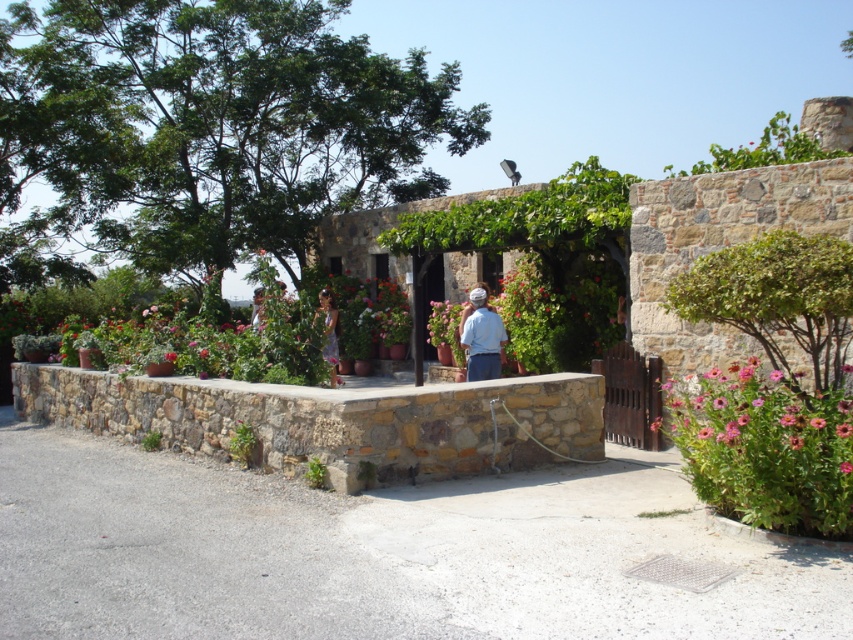
Measure the distance between white cotton shirt at center and matte purple dress at center.

A distance of 3.05 meters exists between white cotton shirt at center and matte purple dress at center.

Does white cotton shirt at center appear on the right side of matte purple dress at center?

Indeed, white cotton shirt at center is positioned on the right side of matte purple dress at center.

Between point (486, 301) and point (334, 332), which one is positioned behind?

Point (334, 332)

Where is `white cotton shirt at center`? white cotton shirt at center is located at coordinates (480, 337).

Based on the photo, is white cotton shirt at center to the left of pink matte flower at center from the viewer's perspective?

Correct, you'll find white cotton shirt at center to the left of pink matte flower at center.

Does point (486, 364) come behind point (848, 464)?

That is True.

This screenshot has height=640, width=853. I want to click on white cotton shirt at center, so click(480, 337).

Is pink matte flower at lower right taller than white cotton shirt at center?

Incorrect, pink matte flower at lower right's height is not larger of white cotton shirt at center's.

The height and width of the screenshot is (640, 853). I want to click on pink matte flower at lower right, so click(757, 419).

The width and height of the screenshot is (853, 640). What are the coordinates of `pink matte flower at lower right` in the screenshot? It's located at (757, 419).